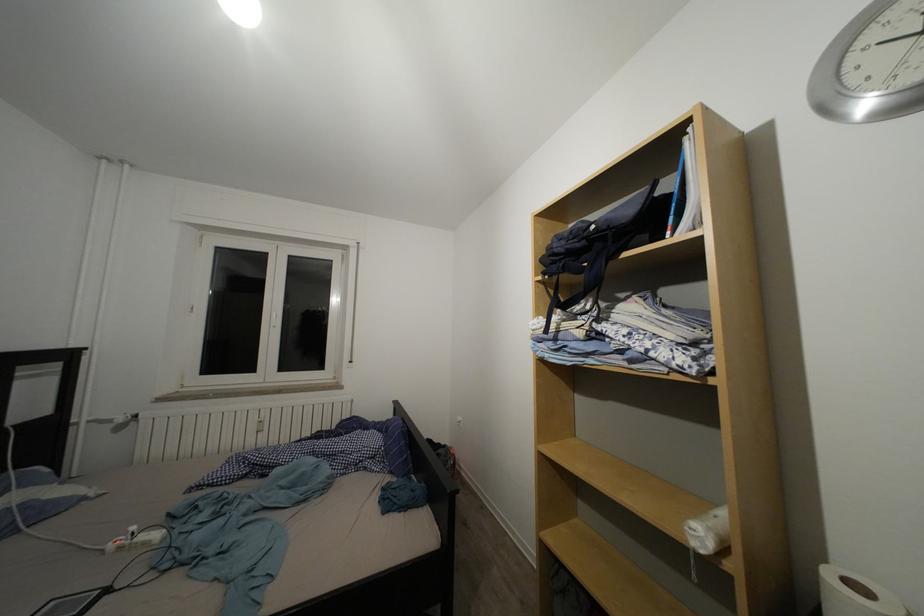
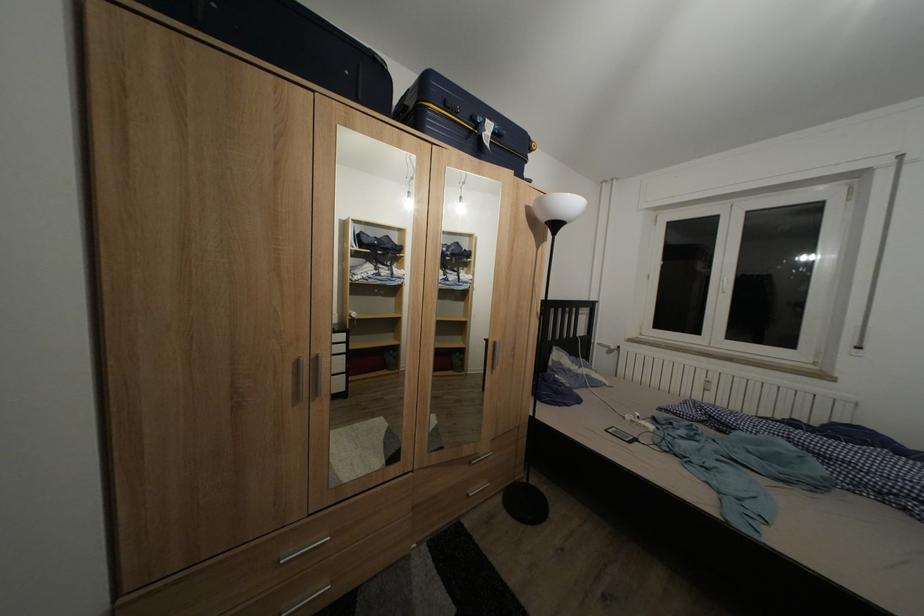
Question: Based on the continuous images, in which direction is the camera rotating? Reply with the corresponding letter.

Choices:
 (A) Left
 (B) Right
 (C) Up
 (D) Down

Answer: (A)